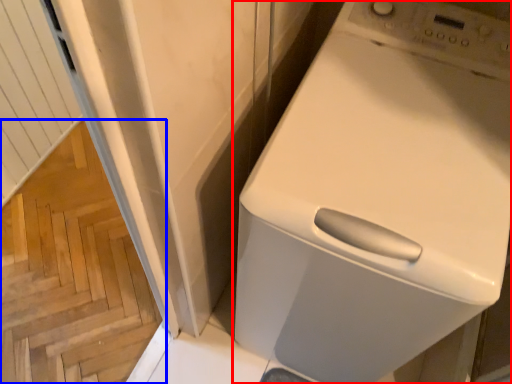
Question: Which of the following is the closest to the observer, home appliance (highlighted by a red box) or stairwell (highlighted by a blue box)?

Choices:
 (A) home appliance
 (B) stairwell

Answer: (A)